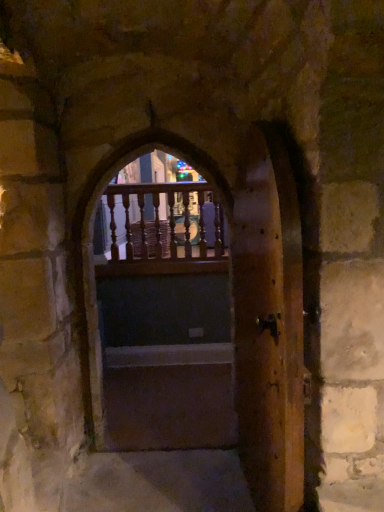
The width and height of the screenshot is (384, 512). I want to click on wooden door at center, the 2th door in the left-to-right sequence, so click(x=268, y=321).

You are a GUI agent. You are given a task and a screenshot of the screen. Output one action in this format:
    pyautogui.click(x=<x>, y=<y>)
    Task: Click on the wooden balusters at center
    
    Given the screenshot: What is the action you would take?
    pyautogui.click(x=164, y=222)

In order to click on wooden door at center, the 2th door in the left-to-right sequence in this screenshot , I will do `click(268, 321)`.

Which is less distant, [161,193] or [212,345]?

Point [161,193]

Is wooden balusters at center in front of wooden door at center, acting as the first door starting from the left?

No, wooden balusters at center is further to the viewer.

Does wooden balusters at center have a lesser height compared to wooden door at center, acting as the first door starting from the left?

Yes.

Is wooden door at center, the second door positioned from the right, wider or thinner than wooden door at center, the 2th door in the left-to-right sequence?

Clearly, wooden door at center, the second door positioned from the right, has more width compared to wooden door at center, the 2th door in the left-to-right sequence.

Are wooden door at center, the second door positioned from the right, and wooden door at center, the 2th door in the left-to-right sequence, making contact?

wooden door at center, the second door positioned from the right, is not next to wooden door at center, the 2th door in the left-to-right sequence, and they're not touching.

How different are the orientations of wooden door at center, the second door positioned from the right, and wooden door at center, the 2th door in the left-to-right sequence, in degrees?

wooden door at center, the second door positioned from the right, and wooden door at center, the 2th door in the left-to-right sequence, are facing 82.7 degrees away from each other.

From a real-world perspective, is wooden door at center, the second door positioned from the right, physically below dark wood door at center?

No, from a real-world perspective, wooden door at center, the second door positioned from the right, is not beneath dark wood door at center.

Is wooden door at center, acting as the first door starting from the left, wider than dark wood door at center?

No.

Which object is positioned more to the right, wooden door at center, acting as the first door starting from the left, or dark wood door at center?

From the viewer's perspective, wooden door at center, acting as the first door starting from the left, appears more on the right side.

Would you say wooden door at center, the second door positioned from the right, is inside or outside dark wood door at center?

wooden door at center, the second door positioned from the right, is spatially situated outside dark wood door at center.

Is wooden door at center, the second door positioned from the right, spatially inside wooden balusters at center, or outside of it?

The correct answer is: outside.

Between wooden door at center, the second door positioned from the right, and wooden balusters at center, which one is positioned behind?

wooden balusters at center is further from the camera.

Are wooden door at center, acting as the first door starting from the left, and wooden balusters at center making contact?

No, wooden door at center, acting as the first door starting from the left, is not next to wooden balusters at center.

This screenshot has width=384, height=512. Find the location of `the 1st door directly beneath the wooden balusters at center (from a real-world perspective)`. the 1st door directly beneath the wooden balusters at center (from a real-world perspective) is located at coordinates (165, 321).

From the image's perspective, which one is positioned higher, wooden door at center, the 2th door in the left-to-right sequence, or wooden balusters at center?

From the image's view, wooden balusters at center is above.

From a real-world perspective, between wooden door at center, the first door viewed from the right, and wooden balusters at center, who is vertically lower?

wooden door at center, the first door viewed from the right.

Looking at this image, would you say wooden door at center, the first door viewed from the right, is outside wooden balusters at center?

Yes, wooden door at center, the first door viewed from the right, is outside of wooden balusters at center.

Is dark wood door at center positioned with its back to wooden balusters at center?

dark wood door at center is not turned away from wooden balusters at center.

Considering the sizes of dark wood door at center and wooden balusters at center in the image, is dark wood door at center bigger or smaller than wooden balusters at center?

In the image, dark wood door at center appears to be smaller than wooden balusters at center.

From the image's perspective, is dark wood door at center over wooden balusters at center?

No, from the image's perspective, dark wood door at center is not above wooden balusters at center.

Considering the points (193, 417) and (122, 200), which point is behind, point (193, 417) or point (122, 200)?

Positioned behind is point (122, 200).

I want to click on stairwell directly beneath the wooden door at center, the second door positioned from the right (from a real-world perspective), so click(x=169, y=397).

Is dark wood door at center taller or shorter than wooden door at center, the second door positioned from the right?

dark wood door at center is shorter than wooden door at center, the second door positioned from the right.

In terms of size, does dark wood door at center appear bigger or smaller than wooden door at center, acting as the first door starting from the left?

Considering their sizes, dark wood door at center takes up less space than wooden door at center, acting as the first door starting from the left.

Identify the location of balcony that appears on the left of wooden door at center, acting as the first door starting from the left. The height and width of the screenshot is (512, 384). (164, 222).

The width and height of the screenshot is (384, 512). I want to click on door located on the right of wooden door at center, acting as the first door starting from the left, so click(268, 321).

In the scene shown: Based on their spatial positions, is wooden door at center, the 2th door in the left-to-right sequence, or wooden door at center, the second door positioned from the right, further from dark wood door at center?

Among the two, wooden door at center, the 2th door in the left-to-right sequence, is located further to dark wood door at center.

Looking at the image, which one is located further to wooden door at center, the second door positioned from the right, dark wood door at center or wooden door at center, the first door viewed from the right?

wooden door at center, the first door viewed from the right, is positioned further to the anchor wooden door at center, the second door positioned from the right.

From the image, which object appears to be nearer to wooden door at center, the second door positioned from the right, wooden door at center, the first door viewed from the right, or dark wood door at center?

dark wood door at center lies closer to wooden door at center, the second door positioned from the right, than the other object.

Considering their positions, is wooden balusters at center positioned further to wooden door at center, acting as the first door starting from the left, than wooden door at center, the 2th door in the left-to-right sequence?

wooden door at center, the 2th door in the left-to-right sequence, is further to wooden door at center, acting as the first door starting from the left.

Considering their positions, is wooden balusters at center positioned closer to dark wood door at center than wooden door at center, the first door viewed from the right?

wooden balusters at center lies closer to dark wood door at center than the other object.

Based on their spatial positions, is wooden balusters at center or dark wood door at center closer to wooden door at center, the 2th door in the left-to-right sequence?

dark wood door at center.

Based on their spatial positions, is wooden door at center, the second door positioned from the right, or dark wood door at center closer to wooden door at center, the 2th door in the left-to-right sequence?

Among the two, dark wood door at center is located nearer to wooden door at center, the 2th door in the left-to-right sequence.

When comparing their distances from dark wood door at center, does wooden balusters at center or wooden door at center, acting as the first door starting from the left, seem closer?

wooden door at center, acting as the first door starting from the left, lies closer to dark wood door at center than the other object.

Find the location of a particular element. The image size is (384, 512). door located between wooden door at center, the first door viewed from the right, and dark wood door at center in the depth direction is located at coordinates (165, 321).

Locate an element on the screen. The image size is (384, 512). door between wooden door at center, the 2th door in the left-to-right sequence, and wooden balusters at center, along the z-axis is located at coordinates pyautogui.click(x=165, y=321).

In order to click on stairwell positioned between wooden door at center, the second door positioned from the right, and wooden balusters at center from near to far in this screenshot , I will do `click(169, 397)`.

Find the location of a particular element. This screenshot has width=384, height=512. stairwell between wooden door at center, the 2th door in the left-to-right sequence, and wooden balusters at center from front to back is located at coordinates (169, 397).